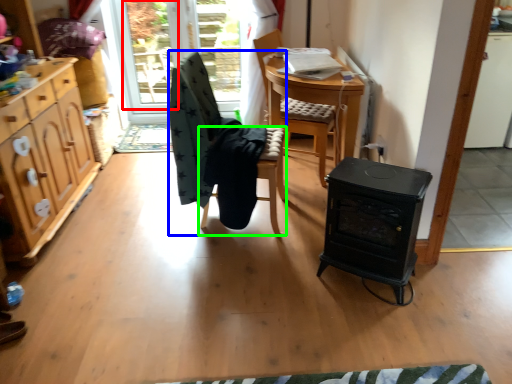
Question: Which object is positioned closest to window screen (highlighted by a red box)? Select from chair (highlighted by a blue box) and chair (highlighted by a green box).

Choices:
 (A) chair
 (B) chair

Answer: (A)